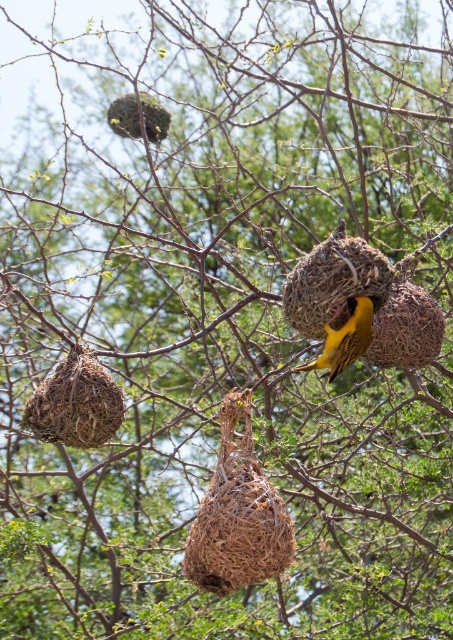
Is brown woven nest at left in front of golden-yellow feathers at center?

No, it is behind golden-yellow feathers at center.

Is point (97, 380) positioned in front of point (375, 308)?

No, it is behind (375, 308).

Describe the element at coordinates (76, 403) in the screenshot. The height and width of the screenshot is (640, 453). I see `brown woven nest at left` at that location.

You are a GUI agent. You are given a task and a screenshot of the screen. Output one action in this format:
    pyautogui.click(x=<x>, y=<y>)
    Task: Click on the brown woven nest at left
    The image size is (453, 640).
    Given the screenshot: What is the action you would take?
    pyautogui.click(x=76, y=403)

Is brown woven nest at center to the left of golden-yellow woven bird at center from the viewer's perspective?

Indeed, brown woven nest at center is positioned on the left side of golden-yellow woven bird at center.

In the scene shown: Which is above, brown woven nest at center or golden-yellow woven bird at center?

Positioned higher is golden-yellow woven bird at center.

Which is behind, point (258, 573) or point (372, 317)?

Positioned behind is point (372, 317).

This screenshot has height=640, width=453. In order to click on brown woven nest at center in this screenshot , I will do `click(237, 515)`.

Consider the image. Between brown woven nest at center and golden-yellow feathers at center, which one has more height?

brown woven nest at center is taller.

Can you confirm if brown woven nest at center is wider than golden-yellow feathers at center?

Yes.

Locate an element on the screen. brown woven nest at center is located at coordinates (237, 515).

At what (x,y) coordinates should I click in order to perform the action: click on brown woven nest at center. Please return your answer as a coordinate pair (x, y). The height and width of the screenshot is (640, 453). Looking at the image, I should click on (237, 515).